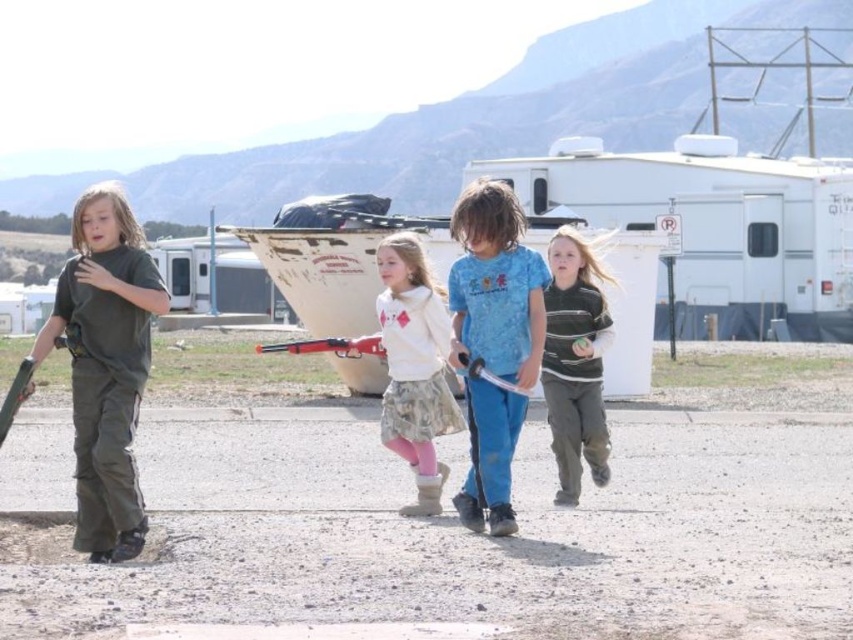
Consider the image. Which is more to the left, dirt track at lower center or white cotton hoodie at center?

From the viewer's perspective, dirt track at lower center appears more on the left side.

Is point (538, 426) closer to camera compared to point (428, 406)?

No, (538, 426) is further to viewer.

Between point (596, 584) and point (430, 400), which one is positioned in front?

Positioned in front is point (596, 584).

I want to click on dirt track at lower center, so click(480, 536).

Can you confirm if blue cotton shirt at center is shorter than striped sweater at center?

In fact, blue cotton shirt at center may be taller than striped sweater at center.

Is blue cotton shirt at center in front of striped sweater at center?

Yes, blue cotton shirt at center is in front of striped sweater at center.

Who is more distant from viewer, (453, 500) or (550, 300)?

The point (550, 300) is more distant.

Where is `blue cotton shirt at center`? Image resolution: width=853 pixels, height=640 pixels. blue cotton shirt at center is located at coordinates (496, 285).

Between point (352, 385) and point (538, 364), which one is positioned in front?

Point (538, 364) is in front.

Locate an element on the screen. This screenshot has height=640, width=853. white matte boat at center is located at coordinates (339, 266).